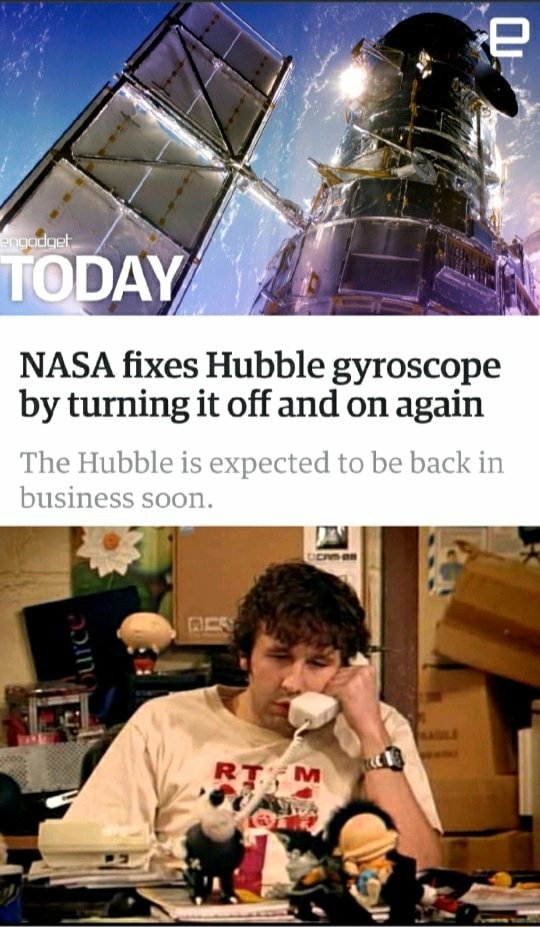
Find the location of a particular element. This screenshot has width=540, height=927. telephone receiver is located at coordinates (308, 705).